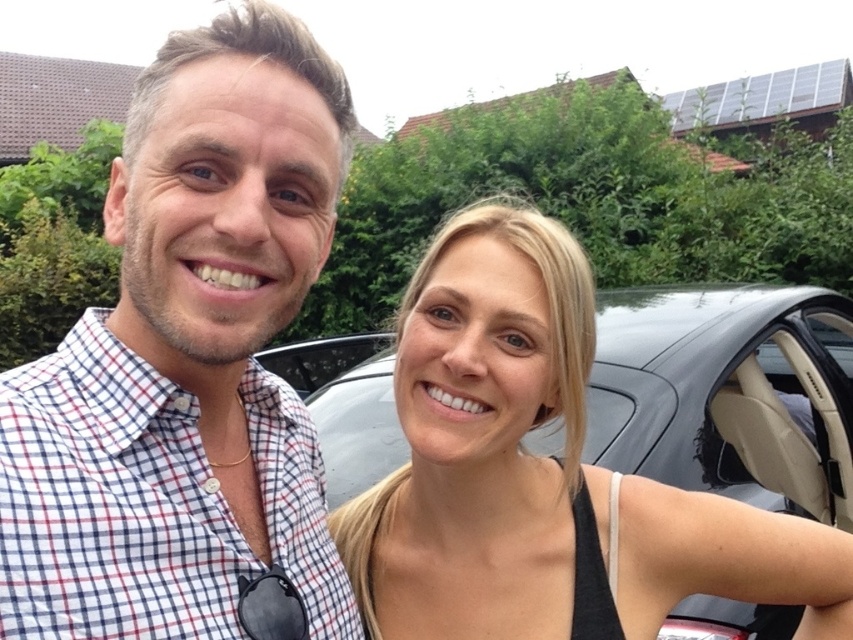
Does checkered fabric shirt at center lie in front of black matte tank top at right?

Yes, it is in front of black matte tank top at right.

Which is behind, point (137, 106) or point (498, 372)?

The point (498, 372) is more distant.

Locate an element on the screen. The image size is (853, 640). checkered fabric shirt at center is located at coordinates (186, 360).

Locate an element on the screen. The image size is (853, 640). checkered fabric shirt at center is located at coordinates (186, 360).